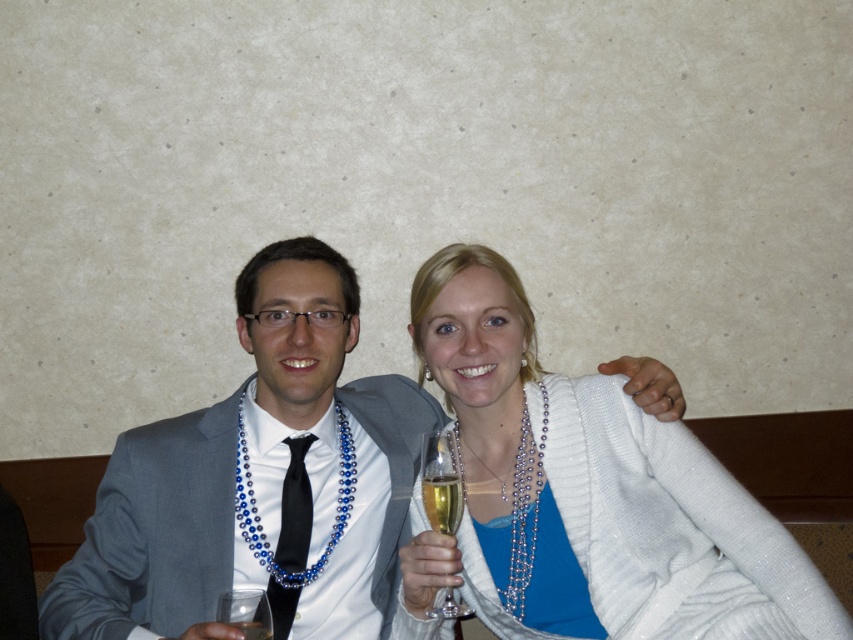
Question: In this image, where is translucent glass at center located relative to clear glass at center?

Choices:
 (A) left
 (B) right

Answer: (B)

Question: Estimate the real-world distances between objects in this image. Which object is closer to the clear glass at center?

Choices:
 (A) matte gray suit at center
 (B) clear glass wine glass at lower left

Answer: (B)

Question: Among these points, which one is nearest to the camera?

Choices:
 (A) (268, 600)
 (B) (444, 524)

Answer: (B)

Question: Can you confirm if clear glass wine glass at lower left is positioned to the right of clear glass at center?

Choices:
 (A) no
 (B) yes

Answer: (A)

Question: Where is black satin tie at center located in relation to clear glass wine glass at lower left in the image?

Choices:
 (A) below
 (B) above

Answer: (B)

Question: Which of the following is the closest to the observer?

Choices:
 (A) (56, 637)
 (B) (228, 605)
 (C) (289, 602)
 (D) (242, 624)

Answer: (B)